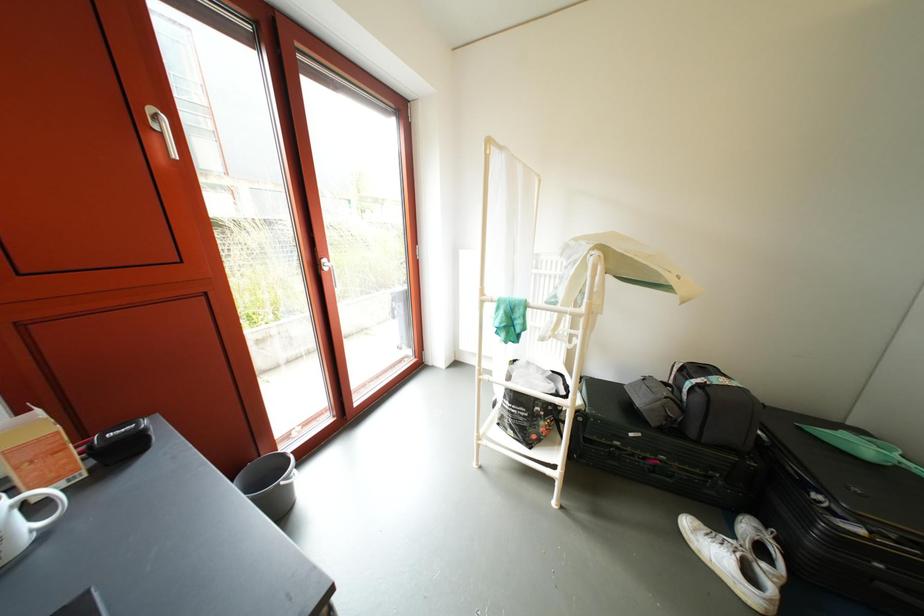
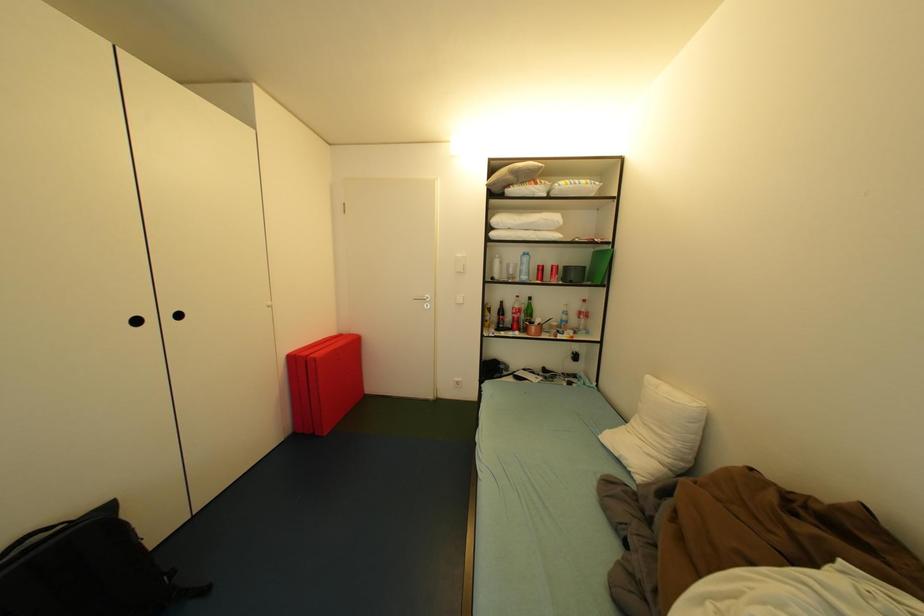
Question: The first image is from the beginning of the video and the second image is from the end. How did the camera likely rotate when shooting the video?

Choices:
 (A) Left
 (B) Right
 (C) Up
 (D) Down

Answer: (B)